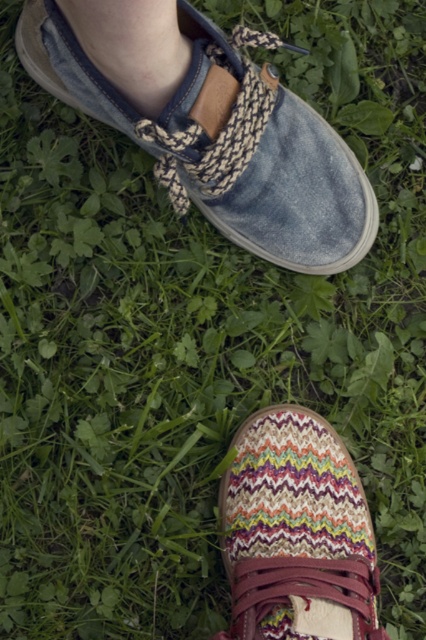
Question: Which of the following is the farthest from the observer?

Choices:
 (A) (348, 461)
 (B) (279, 150)

Answer: (A)

Question: Does denim canvas shoe at upper center appear on the left side of skinny white sock at upper left?

Choices:
 (A) no
 (B) yes

Answer: (A)

Question: Which of the following is the closest to the observer?

Choices:
 (A) denim canvas shoe at upper center
 (B) skinny white sock at upper left

Answer: (B)

Question: From the image, what is the correct spatial relationship of woven fabric shoe at lower center in relation to skinny white sock at upper left?

Choices:
 (A) left
 (B) right

Answer: (B)

Question: Observing the image, what is the correct spatial positioning of denim canvas shoe at upper center in reference to woven fabric shoe at lower center?

Choices:
 (A) above
 (B) below

Answer: (A)

Question: Which object is positioned farthest from the woven fabric shoe at lower center?

Choices:
 (A) skinny white sock at upper left
 (B) denim canvas shoe at upper center

Answer: (A)